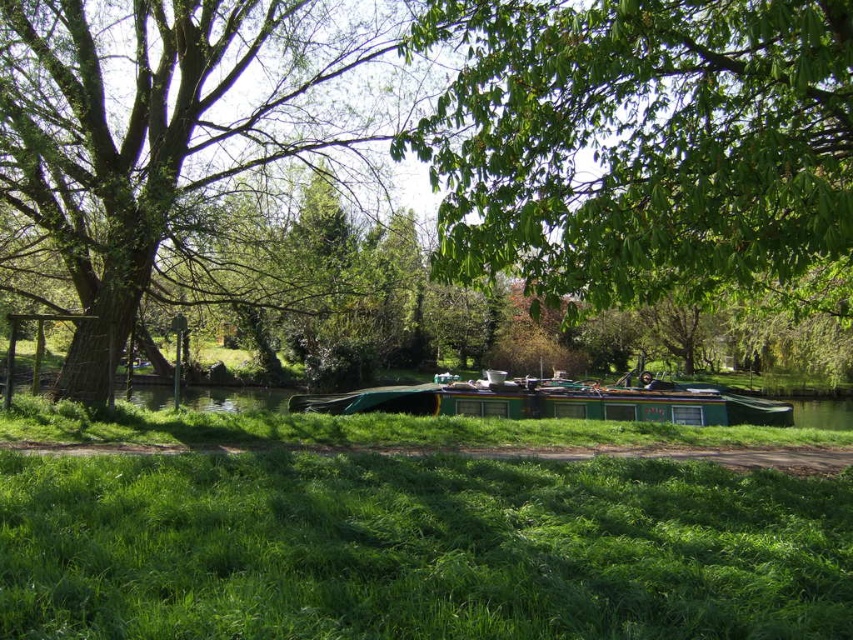
The image size is (853, 640). What do you see at coordinates (173, 120) in the screenshot?
I see `green leafy tree at left` at bounding box center [173, 120].

Which is more to the left, green leafy tree at left or green matte boat at center?

green leafy tree at left

The image size is (853, 640). Identify the location of green leafy tree at left. (173, 120).